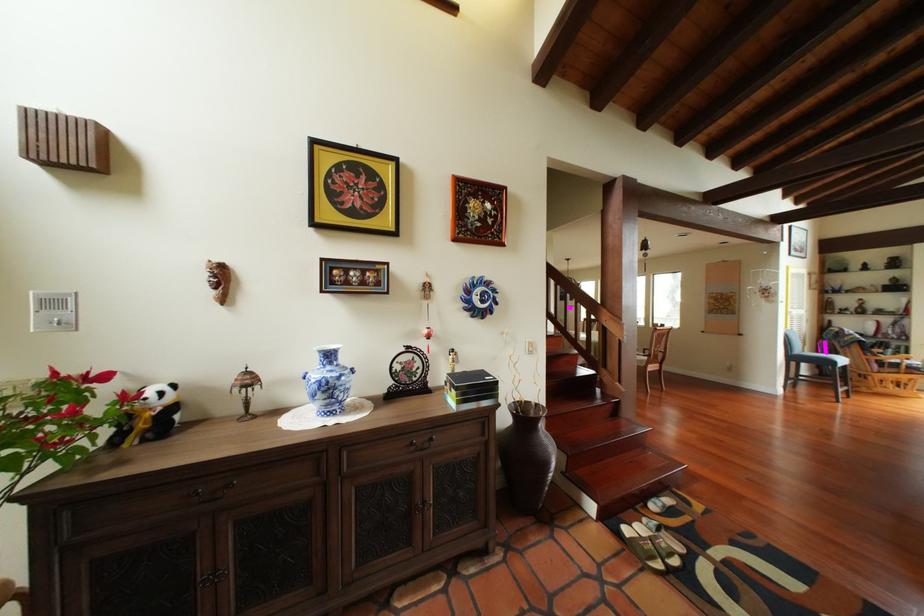
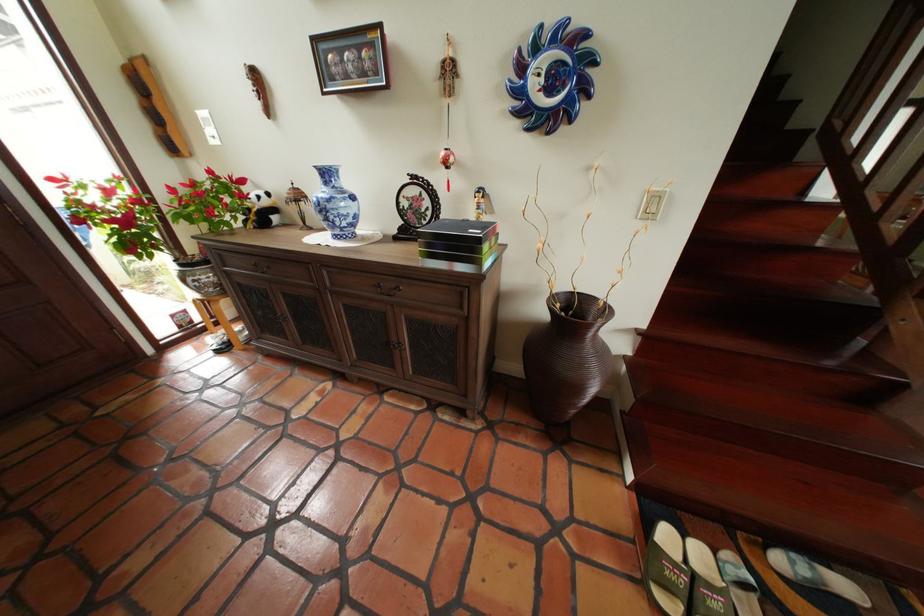
Find the pixel in the second image that matches point (429, 446) in the first image.

(393, 288)